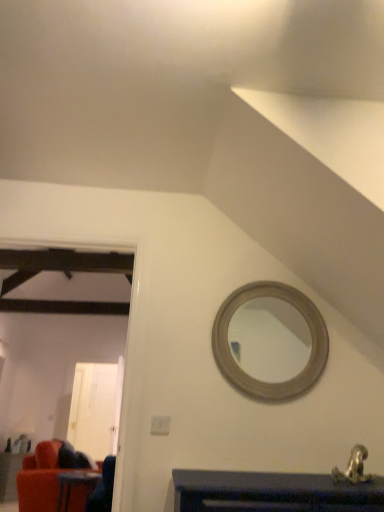
Question: Is velvet red couch at lower left, placed as the 2th table when sorted from top to bottom, at the back of wooden table at lower left, arranged as the second table when viewed from the back?

Choices:
 (A) no
 (B) yes

Answer: (A)

Question: From the image's perspective, is wooden table at lower left, the first table when ordered from right to left, located above velvet red couch at lower left, the first table in the bottom-to-top sequence?

Choices:
 (A) no
 (B) yes

Answer: (B)

Question: Considering the relative sizes of wooden table at lower left, placed as the 1th table when sorted from top to bottom, and velvet red couch at lower left, acting as the second table starting from the right, in the image provided, is wooden table at lower left, placed as the 1th table when sorted from top to bottom, smaller than velvet red couch at lower left, acting as the second table starting from the right,?

Choices:
 (A) no
 (B) yes

Answer: (B)

Question: From a real-world perspective, is wooden table at lower left, acting as the first table starting from the front, positioned over velvet red couch at lower left, placed as the first table when sorted from left to right, based on gravity?

Choices:
 (A) yes
 (B) no

Answer: (A)

Question: From the image's perspective, is wooden table at lower left, placed as the 1th table when sorted from top to bottom, under velvet red couch at lower left, placed as the first table when sorted from left to right?

Choices:
 (A) no
 (B) yes

Answer: (A)

Question: Is velvet red couch at lower left, placed as the first table when sorted from left to right, bigger or smaller than white glossy door at left?

Choices:
 (A) small
 (B) big

Answer: (B)

Question: Looking at their shapes, would you say velvet red couch at lower left, acting as the 2th table starting from the front, is wider or thinner than white glossy door at left?

Choices:
 (A) thin
 (B) wide

Answer: (B)

Question: In the image, is velvet red couch at lower left, placed as the first table when sorted from left to right, on the left side or the right side of white glossy door at left?

Choices:
 (A) left
 (B) right

Answer: (A)

Question: Is point pyautogui.click(x=13, y=500) closer or farther from the camera than point pyautogui.click(x=94, y=396)?

Choices:
 (A) closer
 (B) farther

Answer: (A)

Question: Is wooden table at lower left, arranged as the second table when viewed from the back, taller or shorter than metallic silver faucet at lower right?

Choices:
 (A) short
 (B) tall

Answer: (B)

Question: Looking at their shapes, would you say wooden table at lower left, acting as the first table starting from the front, is wider or thinner than metallic silver faucet at lower right?

Choices:
 (A) thin
 (B) wide

Answer: (B)

Question: Relative to metallic silver faucet at lower right, is wooden table at lower left, acting as the first table starting from the front, in front or behind?

Choices:
 (A) front
 (B) behind

Answer: (B)

Question: Is point coord(69,476) positioned closer to the camera than point coord(360,470)?

Choices:
 (A) farther
 (B) closer

Answer: (A)

Question: Choose the correct answer: Is wooden table at lower left, arranged as the second table when viewed from the back, inside velvet red couch at lower left, acting as the 2th table starting from the front, or outside it?

Choices:
 (A) outside
 (B) inside

Answer: (A)

Question: Would you say wooden table at lower left, the 2th table in the bottom-to-top sequence, is to the left or to the right of velvet red couch at lower left, acting as the second table starting from the right, in the picture?

Choices:
 (A) left
 (B) right

Answer: (B)